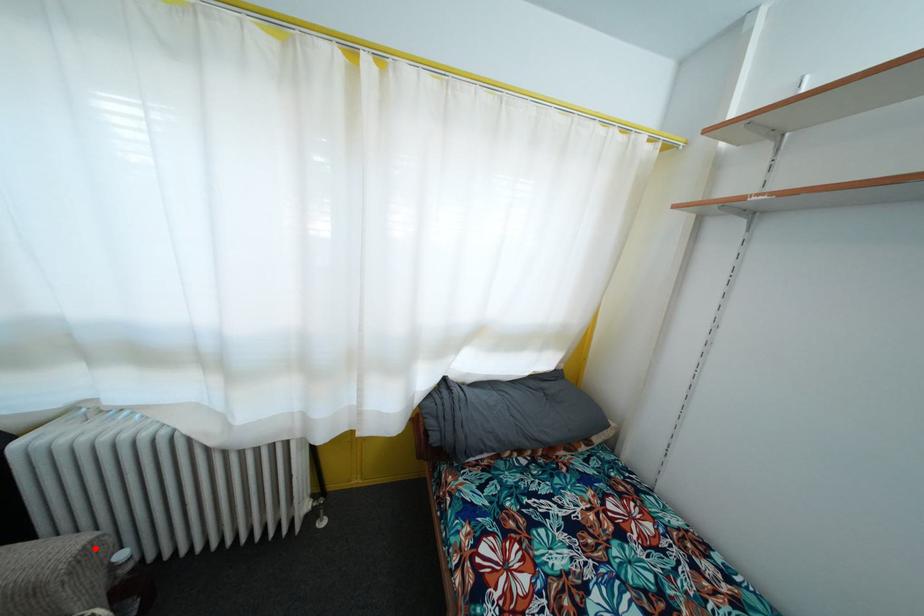
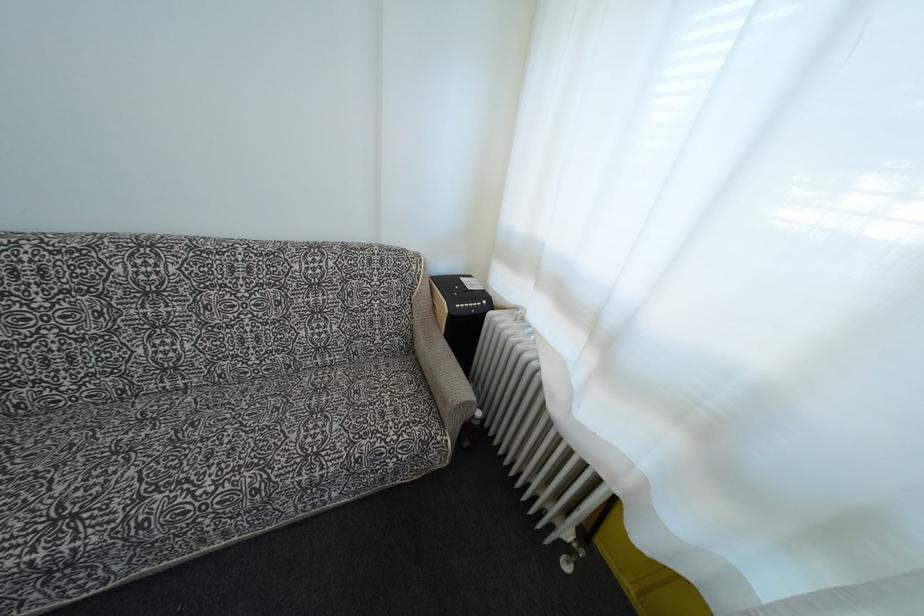
Question: I am providing you with two images of the same scene from different viewpoints. In image1, a red point is highlighted. Considering the same 3D point in image2, which of the following is correct?

Choices:
 (A) It is closer
 (B) It is farther

Answer: (B)